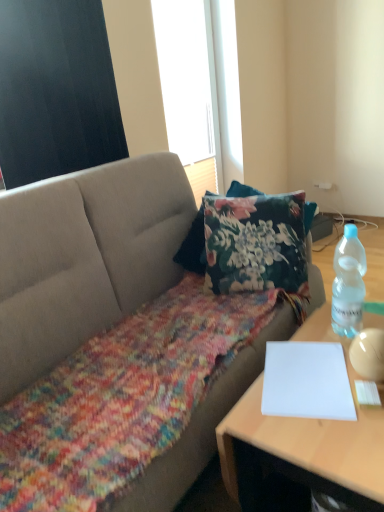
What do you see at coordinates (85, 257) in the screenshot?
I see `textured gray couch at center` at bounding box center [85, 257].

Measure the distance between point (314, 362) and camera.

The distance of point (314, 362) from camera is 1.17 meters.

The width and height of the screenshot is (384, 512). Describe the element at coordinates (56, 90) in the screenshot. I see `black matte window screen at upper left, arranged as the 1th window screen when viewed from the left` at that location.

The image size is (384, 512). What are the coordinates of `clear plastic bottle at right` in the screenshot? It's located at (373, 257).

Consider the image. Considering the relative sizes of white matte window screen at upper center, the first window screen when ordered from back to front, and white paper at right in the image provided, is white matte window screen at upper center, the first window screen when ordered from back to front, wider than white paper at right?

No, white matte window screen at upper center, the first window screen when ordered from back to front, is not wider than white paper at right.

Is the position of white matte window screen at upper center, which is the 1th window screen from right to left, less distant than that of white paper at right?

That is False.

Does white matte window screen at upper center, the first window screen when ordered from back to front, touch white paper at right?

No, white matte window screen at upper center, the first window screen when ordered from back to front, is not touching white paper at right.

Does textured gray couch at center turn towards black matte window screen at upper left, arranged as the 1th window screen when viewed from the left?

Answer: No, textured gray couch at center is not turned towards black matte window screen at upper left, arranged as the 1th window screen when viewed from the left.

From the image's perspective, is textured gray couch at center under black matte window screen at upper left, which is the first window screen in front-to-back order?

Yes.

Which is more distant, (71, 262) or (110, 158)?

The point (110, 158) is more distant.

Identify the location of studio couch in front of the black matte window screen at upper left, which is the second window screen from back to front. The height and width of the screenshot is (512, 384). (85, 257).

Is white paper at right at the back of textured gray couch at center?

No, textured gray couch at center is not facing the opposite direction of white paper at right.

Is white paper at right inside textured gray couch at center?

No, white paper at right is located outside of textured gray couch at center.

Looking at their sizes, would you say textured gray couch at center is wider or thinner than white paper at right?

textured gray couch at center is wider than white paper at right.

From the image's perspective, is textured gray couch at center over white paper at right?

Yes, from the image's perspective, textured gray couch at center is over white paper at right.

Looking at this image, considering the relative sizes of black matte window screen at upper left, which is the first window screen in front-to-back order, and textured gray couch at center in the image provided, is black matte window screen at upper left, which is the first window screen in front-to-back order, thinner than textured gray couch at center?

Yes.

In the scene shown: Which object is more forward, black matte window screen at upper left, arranged as the 1th window screen when viewed from the left, or textured gray couch at center?

textured gray couch at center is closer to the camera.

Is black matte window screen at upper left, which is the second window screen from back to front, facing towards textured gray couch at center?

No, black matte window screen at upper left, which is the second window screen from back to front, is not turned towards textured gray couch at center.

Is black matte window screen at upper left, which is the first window screen in front-to-back order, situated inside textured gray couch at center or outside?

black matte window screen at upper left, which is the first window screen in front-to-back order, is spatially situated outside textured gray couch at center.

Does white paper at right turn towards textured gray couch at center?

No, white paper at right is not facing towards textured gray couch at center.

Would you consider white paper at right to be distant from textured gray couch at center?

That's not correct — white paper at right is a little close to textured gray couch at center.

Can you confirm if white paper at right is positioned to the right of textured gray couch at center?

Indeed, white paper at right is positioned on the right side of textured gray couch at center.

From a real-world perspective, is white paper at right under textured gray couch at center?

Yes, from a real-world perspective, white paper at right is below textured gray couch at center.

Is white paper at right bigger than black matte window screen at upper left, which is the second window screen from back to front?

Indeed, white paper at right has a larger size compared to black matte window screen at upper left, which is the second window screen from back to front.

Could you measure the distance between white paper at right and black matte window screen at upper left, which is the first window screen in front-to-back order?

1.36 meters.

Can you tell me how much white paper at right and black matte window screen at upper left, which is the 2th window screen from right to left, differ in facing direction?

The facing directions of white paper at right and black matte window screen at upper left, which is the 2th window screen from right to left, are 1.36 degrees apart.

Is white paper at right looking in the opposite direction of black matte window screen at upper left, which is the second window screen from back to front?

No, white paper at right's orientation is not away from black matte window screen at upper left, which is the second window screen from back to front.

From a real-world perspective, starting from the white paper at lower right, which window screen is the 2nd one vertically above it? Please provide its 2D coordinates.

[(56, 90)]

Is black matte window screen at upper left, which is the second window screen from back to front, at the right side of white paper at lower right?

No.

Is black matte window screen at upper left, arranged as the 1th window screen when viewed from the left, next to white paper at lower right?

black matte window screen at upper left, arranged as the 1th window screen when viewed from the left, is not next to white paper at lower right, and they're not touching.

From a real-world perspective, between black matte window screen at upper left, which is the 2th window screen from right to left, and white paper at lower right, who is vertically higher?

From a 3D spatial view, black matte window screen at upper left, which is the 2th window screen from right to left, is above.

The width and height of the screenshot is (384, 512). I want to click on desk that appears below the white matte window screen at upper center, positioned as the 2th window screen in front-to-back order (from the image's perspective), so click(305, 441).

Where is `studio couch located in front of the black matte window screen at upper left, which is the second window screen from back to front`? studio couch located in front of the black matte window screen at upper left, which is the second window screen from back to front is located at coordinates (85, 257).

Considering their positions, is clear plastic bottle at right positioned further to white matte window screen at upper center, positioned as the 2th window screen in front-to-back order, than white paper at lower right?

Among the two, white paper at lower right is located further to white matte window screen at upper center, positioned as the 2th window screen in front-to-back order.

Looking at the image, which one is located further to textured gray couch at center, white paper at lower right or white paper at right?

white paper at right lies further to textured gray couch at center than the other object.

Looking at the image, which one is located closer to white paper at lower right, white matte window screen at upper center, positioned as the 2th window screen in front-to-back order, or white paper at right?

white paper at right.

Looking at this image, looking at the image, which one is located further to textured gray couch at center, white matte window screen at upper center, which is the 1th window screen from right to left, or white paper at lower right?

Among the two, white matte window screen at upper center, which is the 1th window screen from right to left, is located further to textured gray couch at center.

Which object lies further to the anchor point white matte window screen at upper center, positioned as the 2th window screen in front-to-back order, textured gray couch at center or white paper at lower right?

white paper at lower right is positioned further to the anchor white matte window screen at upper center, positioned as the 2th window screen in front-to-back order.

Looking at the image, which one is located closer to clear plastic bottle at right, white paper at lower right or black matte window screen at upper left, arranged as the 1th window screen when viewed from the left?

white paper at lower right is positioned closer to the anchor clear plastic bottle at right.

When comparing their distances from textured gray couch at center, does white paper at lower right or white matte window screen at upper center, the first window screen when ordered from back to front, seem further?

white matte window screen at upper center, the first window screen when ordered from back to front, is positioned further to the anchor textured gray couch at center.

Based on their spatial positions, is white paper at lower right or white matte window screen at upper center, positioned as the 2th window screen in left-to-right order, closer to white paper at right?

white paper at lower right.

Identify the location of notebook between black matte window screen at upper left, which is the second window screen from back to front, and white paper at right vertically. (307, 381).

At what (x,y) coordinates should I click in order to perform the action: click on notebook located between textured gray couch at center and clear plastic bottle at right in the left-right direction. Please return your answer as a coordinate pair (x, y). The image size is (384, 512). Looking at the image, I should click on (307, 381).

Image resolution: width=384 pixels, height=512 pixels. I want to click on notebook between clear plastic bottle at right and white paper at right in the vertical direction, so click(307, 381).

Where is `table between black matte window screen at upper left, which is the 2th window screen from right to left, and white paper at right, in the vertical direction`? This screenshot has height=512, width=384. table between black matte window screen at upper left, which is the 2th window screen from right to left, and white paper at right, in the vertical direction is located at coordinates (373, 257).